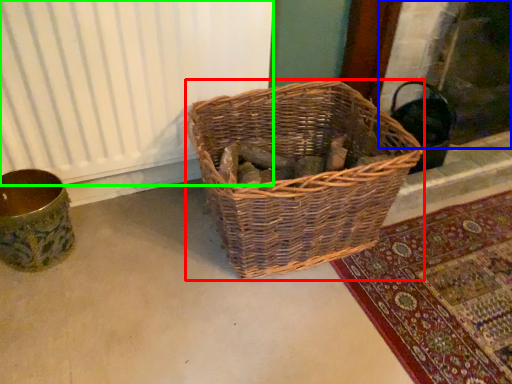
Question: Which is farther away from picnic basket (highlighted by a red box)? fireplace (highlighted by a blue box) or radiator (highlighted by a green box)?

Choices:
 (A) fireplace
 (B) radiator

Answer: (A)